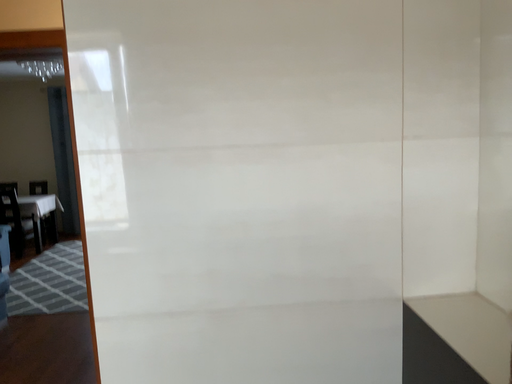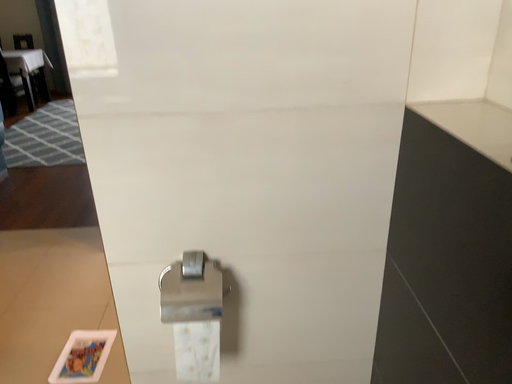
Question: How did the camera likely rotate when shooting the video?

Choices:
 (A) rotated downward
 (B) rotated upward

Answer: (A)